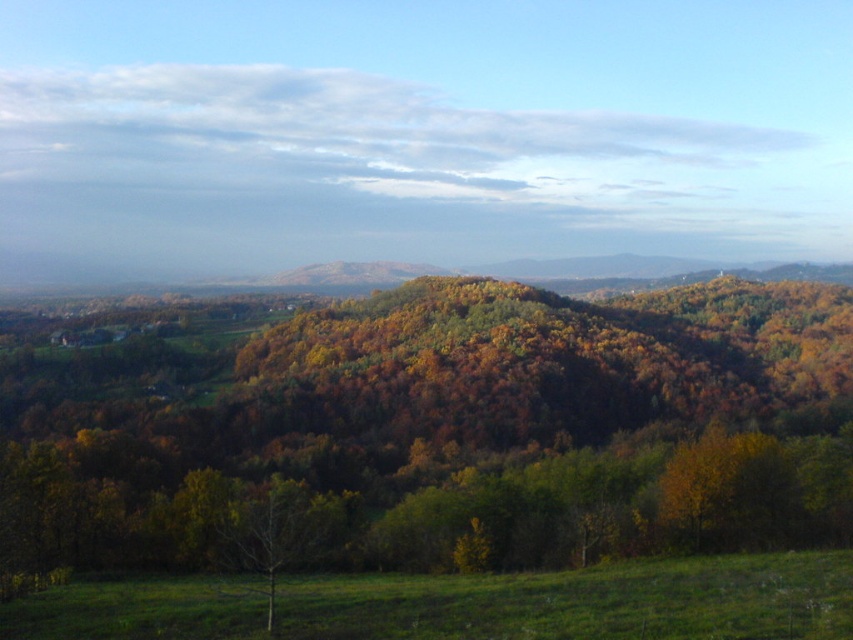
You are standing at the point with coordinates point (286, 524) and want to walk towards the point with coordinates point (786, 508). Which direction should you move in order to reach your destination?

You should move forward because point (786, 508) is behind point (286, 524), meaning it is in the direction you are facing when standing at point (286, 524).